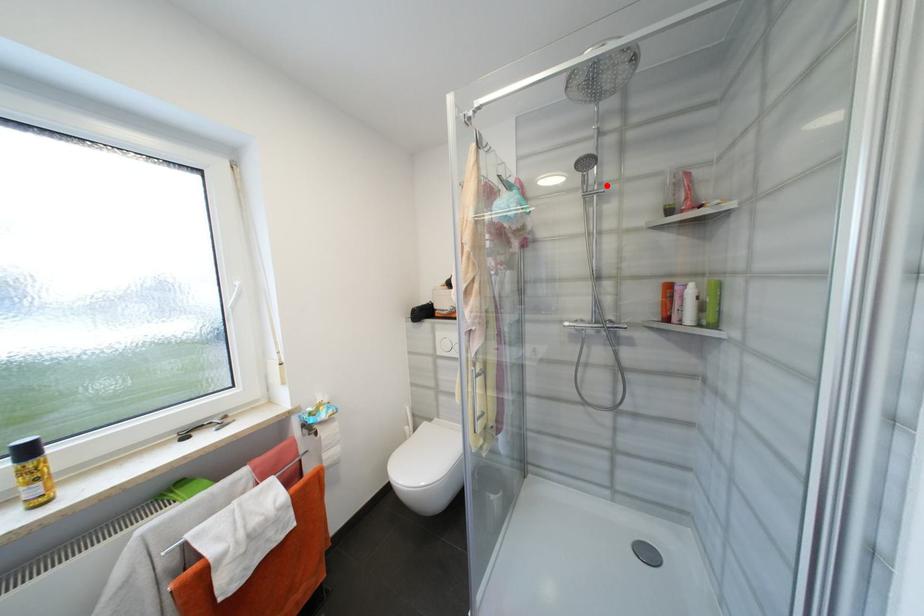
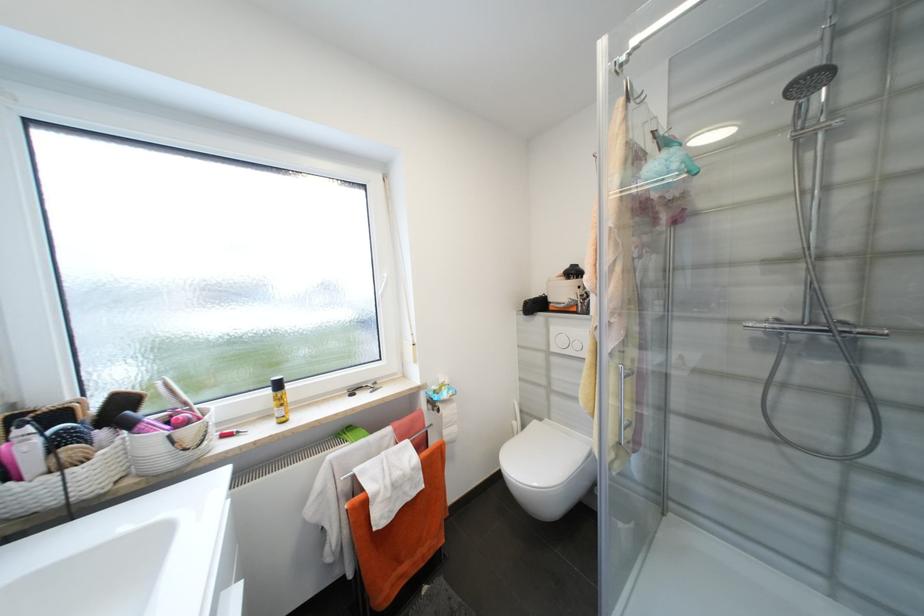
The point at the highlighted location is marked in the first image. Where is the corresponding point in the second image?

(839, 114)